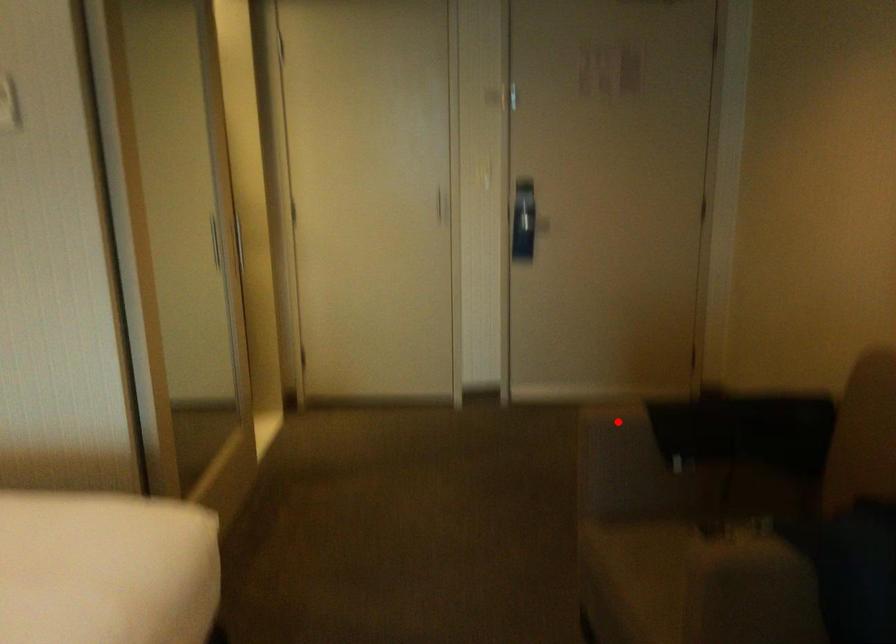
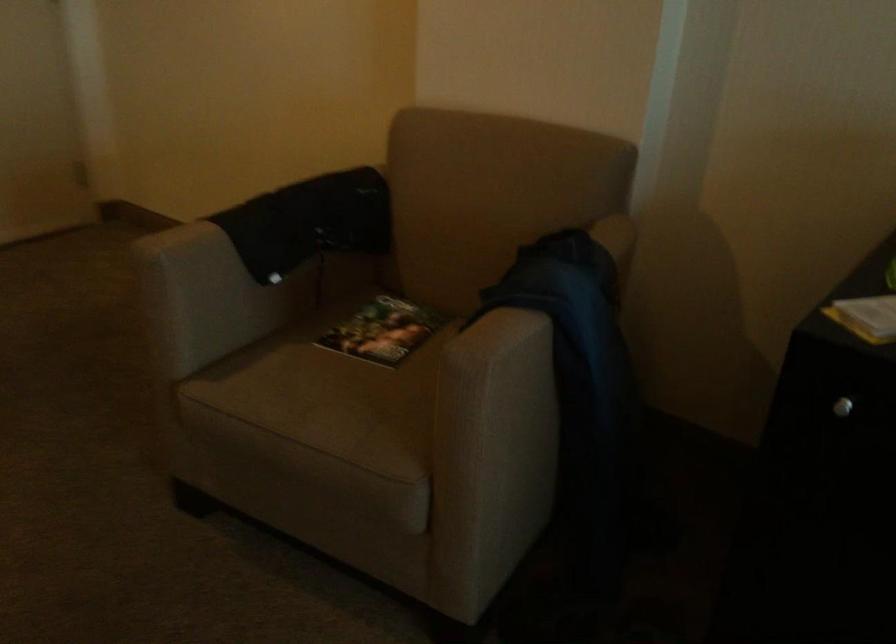
Find the pixel in the second image that matches the highlighted location in the first image.

(201, 243)